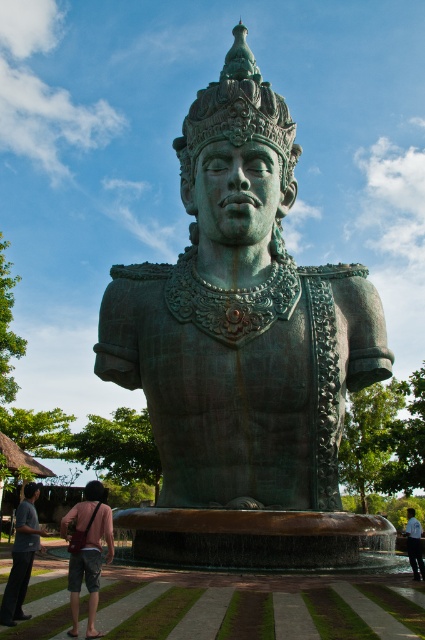
Consider the image. Who is taller, green patina bronze statue at center or light blue shirt at lower right?

Standing taller between the two is green patina bronze statue at center.

Is green patina bronze statue at center positioned before light blue shirt at lower right?

Yes, green patina bronze statue at center is in front of light blue shirt at lower right.

Between point (215, 465) and point (413, 568), which one is positioned in front?

Positioned in front is point (215, 465).

In order to click on green patina bronze statue at center in this screenshot , I will do `click(241, 317)`.

Which of these two, matte bronze statue at lower left or light blue shirt at lower right, stands taller?

Standing taller between the two is matte bronze statue at lower left.

Between point (22, 502) and point (410, 512), which one is positioned in front?

Point (22, 502)

Which is in front, point (30, 500) or point (413, 572)?

Point (30, 500) is in front.

Locate an element on the screen. The width and height of the screenshot is (425, 640). matte bronze statue at lower left is located at coordinates (22, 556).

Is green patina bronze statue at center positioned in front of matte bronze statue at lower left?

No, green patina bronze statue at center is further to the viewer.

Which is more to the right, green patina bronze statue at center or matte bronze statue at lower left?

green patina bronze statue at center is more to the right.

Identify the location of green patina bronze statue at center. (241, 317).